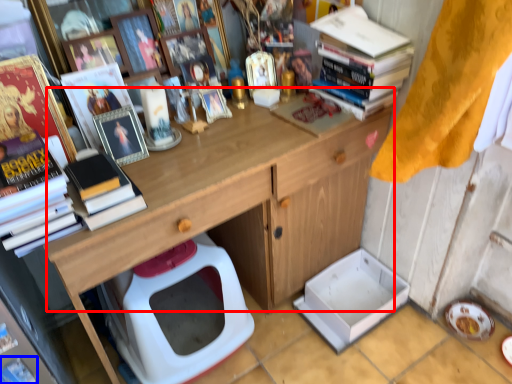
Question: Which of the following is the farthest to the observer, counter top (highlighted by a red box) or magazine (highlighted by a blue box)?

Choices:
 (A) counter top
 (B) magazine

Answer: (B)